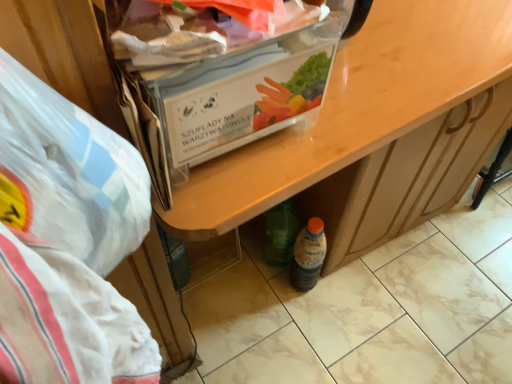
Identify the location of free space above wooden desk at center (from a real-world perspective). The width and height of the screenshot is (512, 384). click(405, 49).